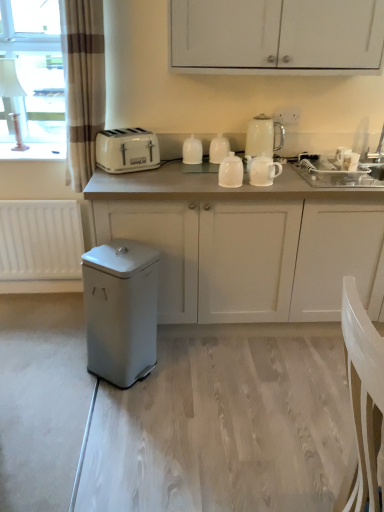
Locate an element on the screen. This screenshot has height=512, width=384. vacant area to the right of white matte trash can at lower left is located at coordinates [x=177, y=367].